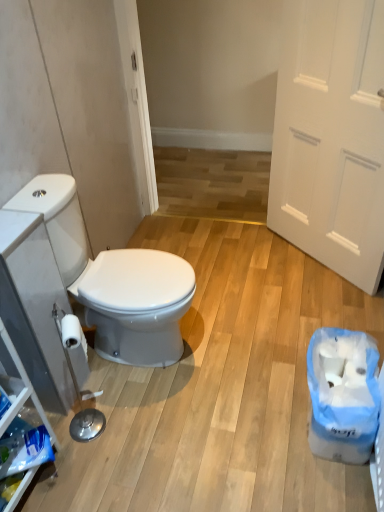
Identify the location of vacant space underneath white matte door at right (from a real-world perspective). (314, 264).